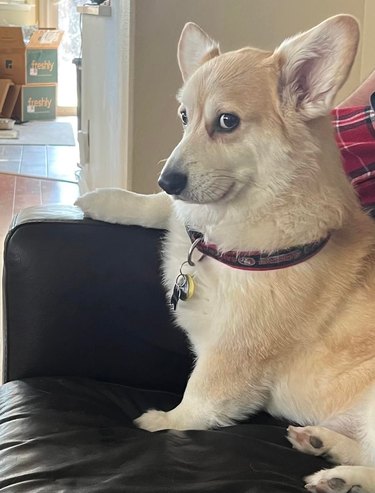
At what (x,y) coordinates should I click in order to perform the action: click on floor. Please return your answer as a coordinate pair (x, y). The image size is (375, 493). Looking at the image, I should click on (15, 195), (49, 155).